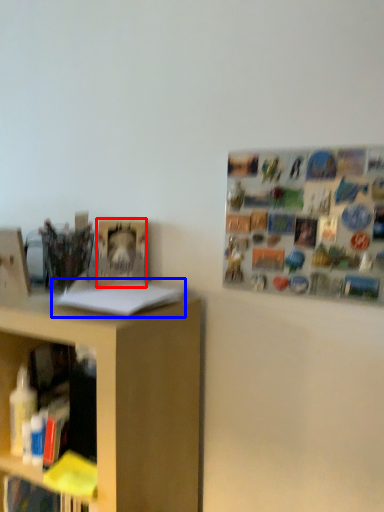
Question: Which object is closer to the camera taking this photo, book (highlighted by a red box) or book (highlighted by a blue box)?

Choices:
 (A) book
 (B) book

Answer: (B)